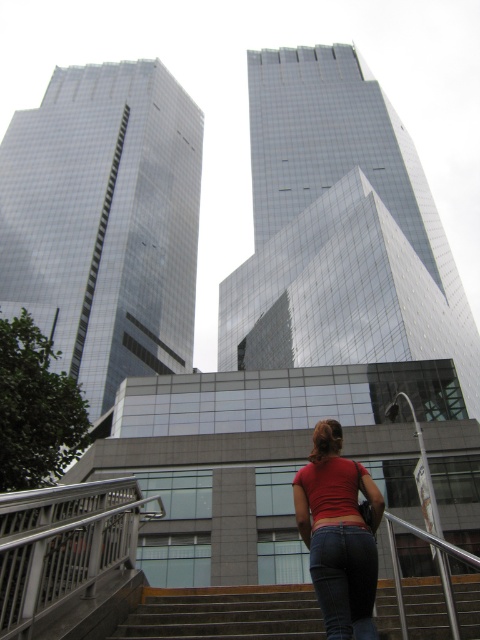
Is reflective glass skyscraper at center to the right of concrete stairs at lower center from the viewer's perspective?

Indeed, reflective glass skyscraper at center is positioned on the right side of concrete stairs at lower center.

Looking at this image, does reflective glass skyscraper at center appear over concrete stairs at lower center?

Yes, reflective glass skyscraper at center is above concrete stairs at lower center.

The image size is (480, 640). I want to click on reflective glass skyscraper at center, so click(x=339, y=228).

Does silver metallic rail at lower left appear on the left side of denim at center?

Correct, you'll find silver metallic rail at lower left to the left of denim at center.

Is point (85, 506) positioned before point (347, 540)?

No.

Between point (60, 518) and point (355, 612), which one is positioned behind?

The point (60, 518) is behind.

Locate an element on the screen. silver metallic rail at lower left is located at coordinates (64, 544).

Who is more distant from viewer, (187, 620) or (307, 544)?

Point (187, 620)

Between concrete stairs at lower center and red matte shirt at center, which one has less height?

Standing shorter between the two is concrete stairs at lower center.

Is point (233, 605) farther from camera compared to point (348, 490)?

Yes, point (233, 605) is farther from viewer.

You are a GUI agent. You are given a task and a screenshot of the screen. Output one action in this format:
    pyautogui.click(x=<x>, y=<y>)
    Task: Click on the concrete stairs at lower center
    This screenshot has width=480, height=640.
    Given the screenshot: What is the action you would take?
    pyautogui.click(x=226, y=612)